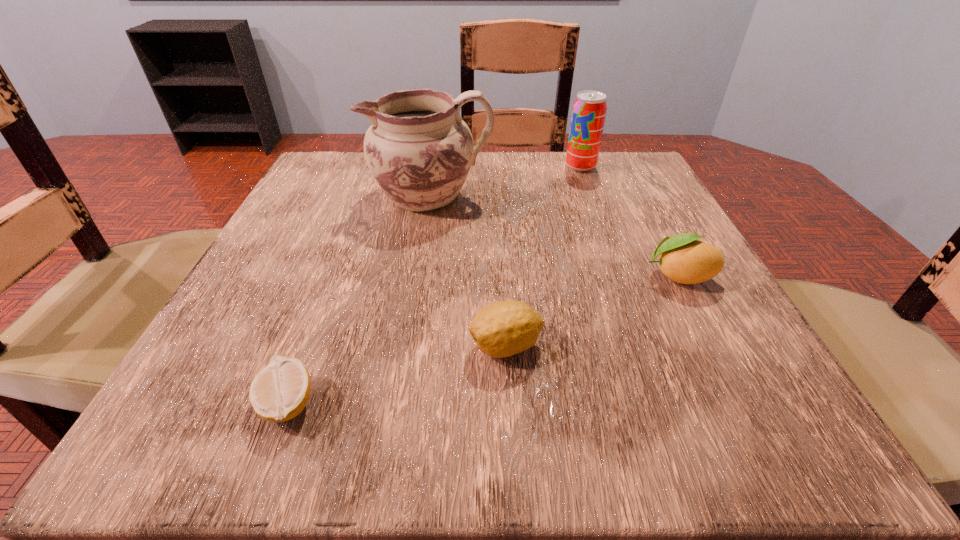
In the image, there is a desktop. Identify the location of vacant space at the far edge. This screenshot has height=540, width=960. (512, 160).

Where is `vacant space at the near edge`? vacant space at the near edge is located at coordinates (627, 425).

In the image, there is a desktop. Where is `vacant space at the left edge`? vacant space at the left edge is located at coordinates (342, 278).

Locate an element on the screen. vacant space at the right edge of the desktop is located at coordinates pyautogui.click(x=617, y=213).

This screenshot has height=540, width=960. I want to click on vacant space at the far left corner of the desktop, so click(321, 160).

I want to click on free spot at the far right corner of the desktop, so click(x=605, y=179).

Locate an element on the screen. Image resolution: width=960 pixels, height=540 pixels. blank region between the fourth shortest object and the shortest lemon is located at coordinates (434, 285).

Where is `empty space that is in between the pitcher and the rightmost object`? Image resolution: width=960 pixels, height=540 pixels. empty space that is in between the pitcher and the rightmost object is located at coordinates (555, 236).

Identify the location of unoccupied area between the second tallest object and the farthest lemon. The height and width of the screenshot is (540, 960). (630, 221).

Locate an element on the screen. The height and width of the screenshot is (540, 960). free point between the soda can and the shortest object is located at coordinates (434, 285).